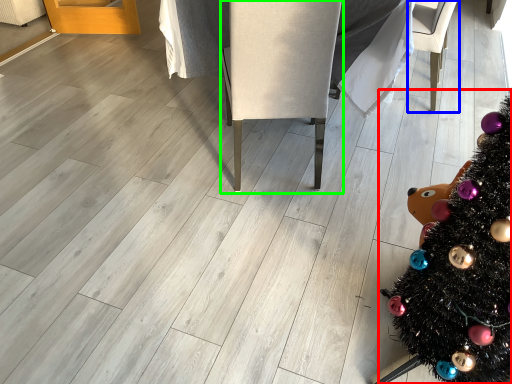
Question: Considering the real-world distances, which object is closest to christmas tree (highlighted by a red box)? armchair (highlighted by a blue box) or armchair (highlighted by a green box).

Choices:
 (A) armchair
 (B) armchair

Answer: (B)